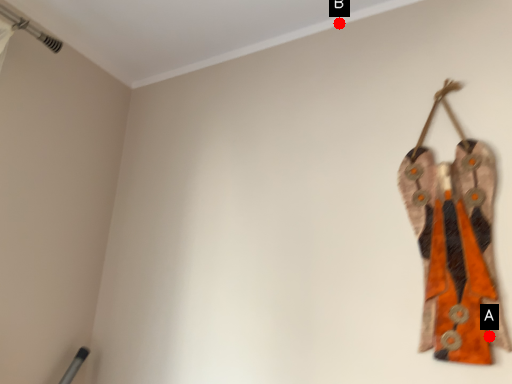
Question: Two points are circled on the image, labeled by A and B beside each circle. Which point is closer to the camera taking this photo?

Choices:
 (A) A is closer
 (B) B is closer

Answer: (A)